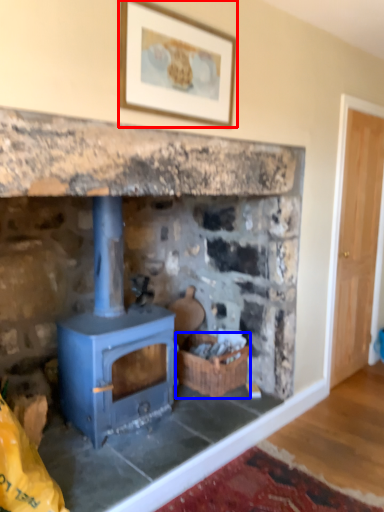
Question: Among these objects, which one is farthest to the camera, picture frame (highlighted by a red box) or basket (highlighted by a blue box)?

Choices:
 (A) picture frame
 (B) basket

Answer: (B)